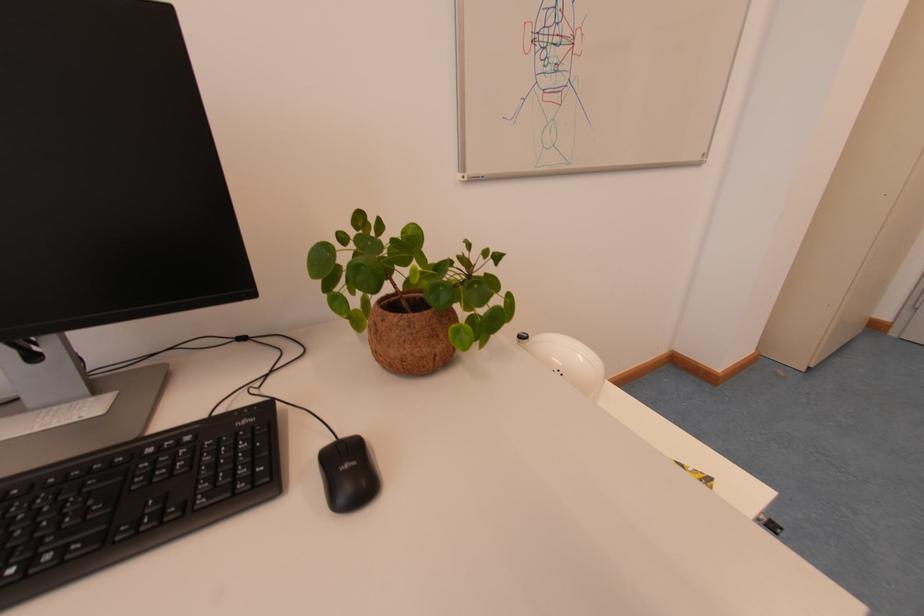
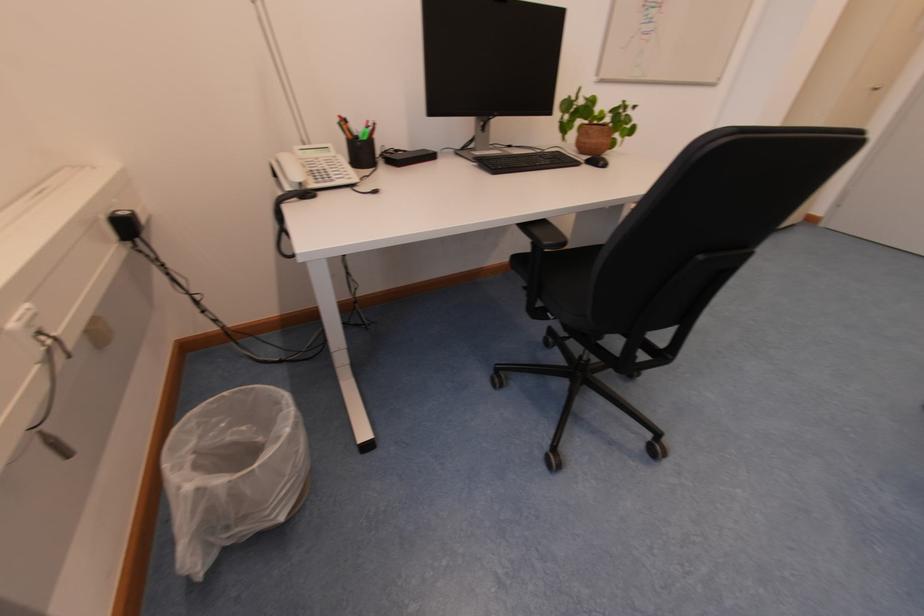
The images are taken continuously from a first-person perspective. In which direction are you moving?

The movement direction of the cameraman is left, backward.